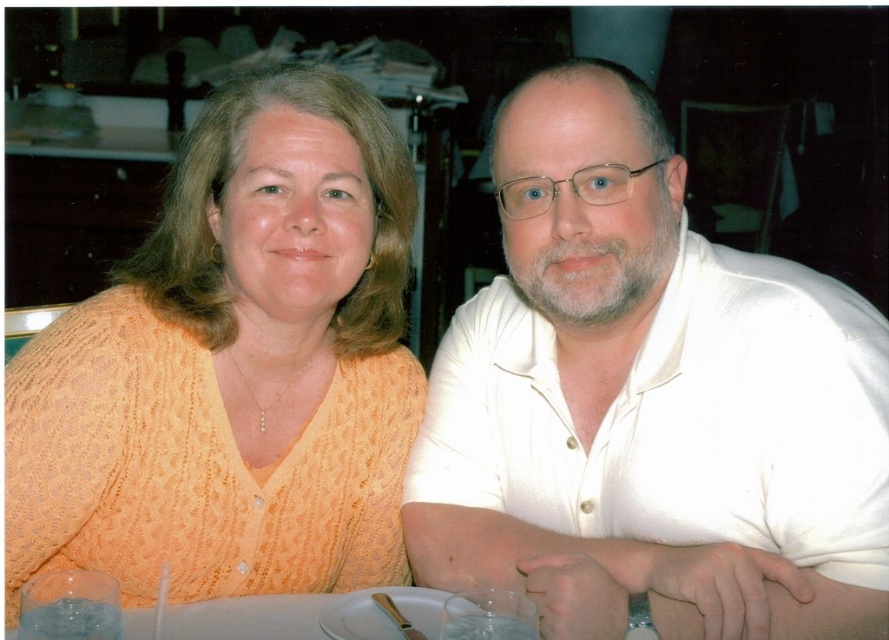
Question: Can you confirm if white smooth shirt at right is positioned above orange knitted sweater at left?

Choices:
 (A) no
 (B) yes

Answer: (A)

Question: Is white smooth shirt at right above orange knitted sweater at left?

Choices:
 (A) no
 (B) yes

Answer: (A)

Question: Does white smooth shirt at right have a greater width compared to orange knitted sweater at left?

Choices:
 (A) no
 (B) yes

Answer: (B)

Question: Which object is closer to the camera taking this photo?

Choices:
 (A) orange knitted sweater at left
 (B) white smooth shirt at right

Answer: (B)